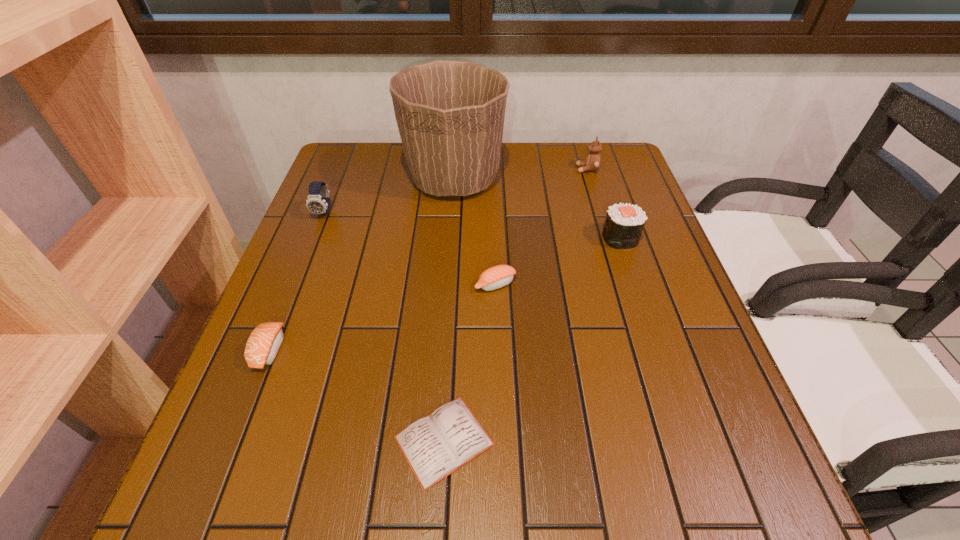
The image size is (960, 540). What are the coordinates of `free space that satisfies the following two spatial constraints: 1. on the back side of the farthest sushi; 2. on the front-facing side of the teddy bear` in the screenshot? It's located at (597, 169).